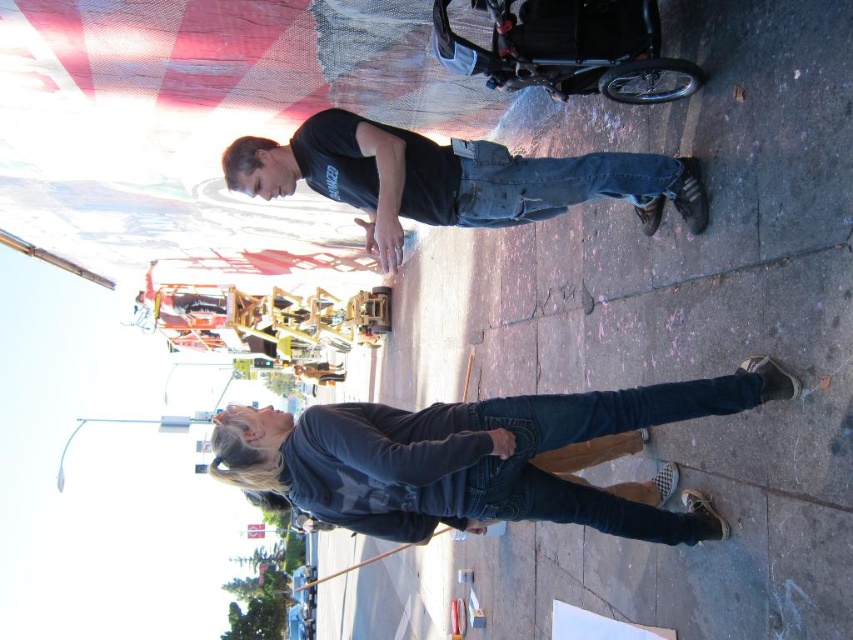
Who is higher up, denim jeans at lower center or black matte shirt at center?

black matte shirt at center

Is denim jeans at lower center thinner than black matte shirt at center?

In fact, denim jeans at lower center might be wider than black matte shirt at center.

This screenshot has height=640, width=853. In order to click on denim jeans at lower center in this screenshot , I will do `click(485, 458)`.

Is black matte shirt at center taller than denim jeans at center?

Indeed, black matte shirt at center has a greater height compared to denim jeans at center.

Which is in front, point (369, 157) or point (508, 189)?

Point (369, 157) is in front.

Find the location of `black matte shirt at center`. black matte shirt at center is located at coordinates (451, 179).

Is denim jeans at lower center wider than denim jeans at center?

Yes.

Does denim jeans at lower center lie in front of denim jeans at center?

Yes, denim jeans at lower center is in front of denim jeans at center.

The height and width of the screenshot is (640, 853). What are the coordinates of `denim jeans at lower center` in the screenshot? It's located at (485, 458).